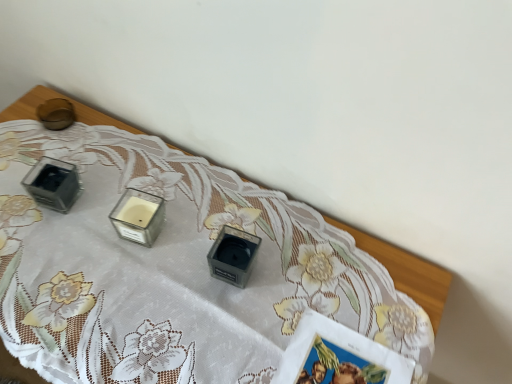
Image resolution: width=512 pixels, height=384 pixels. Find the location of `free space to the left of clear glass candle at center`. free space to the left of clear glass candle at center is located at coordinates (64, 215).